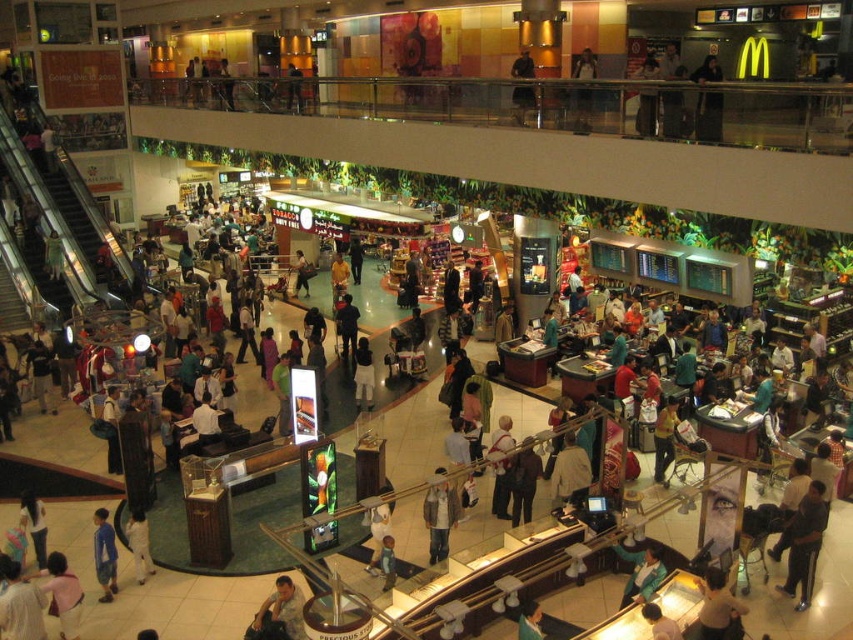
From the picture: You are standing at the point labeled as point (643, 616) in the mall. You need to reach the customer service desk located at the opposite end of the mall. Considering the distance between these two points is 15.59 meters, can you estimate how long it would take you to walk there at a normal pace?

The distance between the point labeled as point (643, 616) and the customer service desk is 15.59 meters. At a normal walking pace of approximately 1.4 meters per second, it would take roughly 11 seconds to reach the destination.

You are a customer standing at the entrance of the mall and see both the white matte dress at center and the dark blue shirt at center. Which item is farther away from you?

The distance between the white matte dress at center and the dark blue shirt at center is 12.10 meters, so both items are equally distant from you since they are at the same central position.